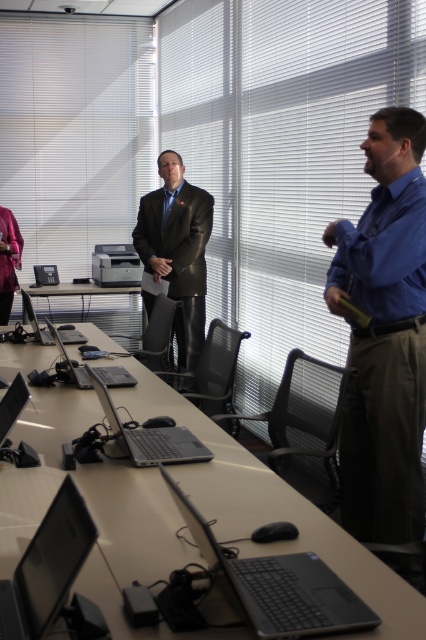
You are an office worker who needs to place a new laptop on the table. The laptop is 15 inches wide. The table has a width of 2 meters. Can you place the laptop on the light brown wooden table at center without overlapping the black leather jacket at center?

The light brown wooden table at center is below the black leather jacket at center, so the jacket is placed above the table. Since the table is 2 meters wide, which is significantly larger than the 15 inch laptop, you can place the laptop on the table without overlapping the jacket as long as there is enough space not occupied by the jacket.

You are sitting at the conference table and need to locate the satin black laptop at lower left and the silver metallic laptop at center. Based on their positions, which laptop is closer to the left end of the table?

The satin black laptop at lower left is positioned on the right side of the silver metallic laptop at center, so the silver metallic laptop at center is closer to the left end of the table.

You are organizing a meeting in the office. You need to place a large presentation board next to the light brown wooden table at center and the matte black printer at left. Which object should you place it next to if you want it to be near the larger object?

You should place the large presentation board next to the light brown wooden table at center because it is bigger than the matte black printer at left.